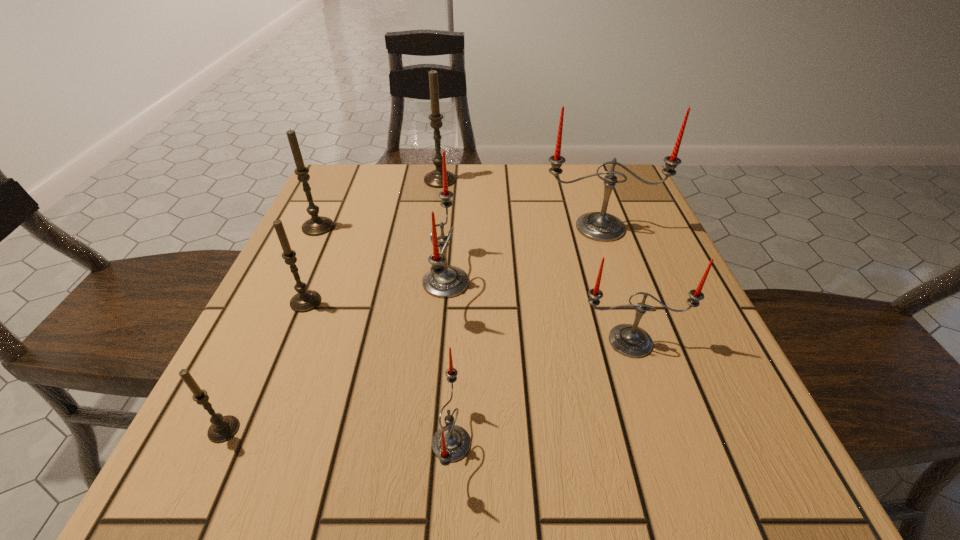
You are a GUI agent. You are given a task and a screenshot of the screen. Output one action in this format:
    pyautogui.click(x=<x>, y=<y>)
    Task: Click on the vacant space at the far edge of the desktop
    This screenshot has height=540, width=960.
    Given the screenshot: What is the action you would take?
    pyautogui.click(x=405, y=177)

You are a GUI agent. You are given a task and a screenshot of the screen. Output one action in this format:
    pyautogui.click(x=<x>, y=<y>)
    Task: Click on the vacant space at the near edge of the desktop
    Image resolution: width=960 pixels, height=540 pixels.
    Given the screenshot: What is the action you would take?
    pyautogui.click(x=558, y=475)

I want to click on vacant area at the left edge of the desktop, so click(345, 251).

The width and height of the screenshot is (960, 540). Find the location of `free location at the right edge of the desktop`. free location at the right edge of the desktop is located at coordinates (628, 292).

Image resolution: width=960 pixels, height=540 pixels. I want to click on vacant space at the far left corner of the desktop, so click(354, 185).

In order to click on vacant space at the far right corner in this screenshot , I will do `click(638, 192)`.

The height and width of the screenshot is (540, 960). In order to click on vacant space that is in between the second farthest gray candle and the nearest red candle in this screenshot , I will do `click(385, 335)`.

Where is `free space that is in between the third smallest red candle and the farthest red candle`? free space that is in between the third smallest red candle and the farthest red candle is located at coordinates (523, 255).

Locate an element on the screen. The width and height of the screenshot is (960, 540). vacant area that lies between the second farthest gray candle and the smallest gray candle is located at coordinates (271, 328).

You are a GUI agent. You are given a task and a screenshot of the screen. Output one action in this format:
    pyautogui.click(x=<x>, y=<y>)
    Task: Click on the free space between the sixth farthest candle and the third biggest gray candle
    The image size is (960, 540).
    Given the screenshot: What is the action you would take?
    pos(468,321)